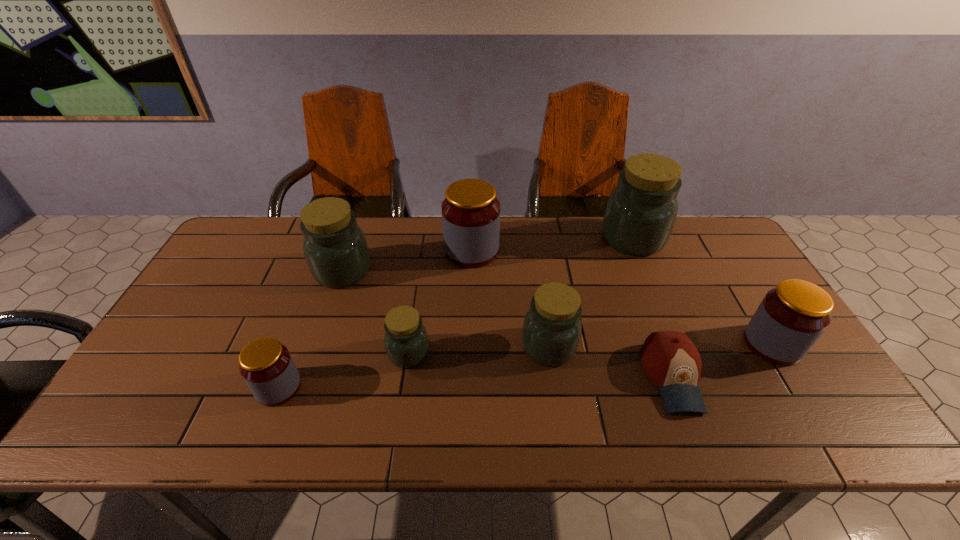
This screenshot has width=960, height=540. Find the location of `free space between the shortest object and the third biggest green jar`. free space between the shortest object and the third biggest green jar is located at coordinates (611, 362).

Where is `blank region between the leftmost green jar and the third jar from right to left`? This screenshot has width=960, height=540. blank region between the leftmost green jar and the third jar from right to left is located at coordinates (445, 309).

At what (x,y) coordinates should I click in order to perform the action: click on empty space that is in between the smallest green jar and the biggest red jar. Please return your answer as a coordinate pair (x, y). Looking at the image, I should click on point(441,302).

At what (x,y) coordinates should I click in order to perform the action: click on vacant area that lies between the fifth object from right to left and the leftmost green jar. Please return your answer as a coordinate pair (x, y). The image size is (960, 540). Looking at the image, I should click on (407, 261).

Find the location of `free spot between the sixth object from right to left and the fourth object from right to left`. free spot between the sixth object from right to left and the fourth object from right to left is located at coordinates (479, 350).

The image size is (960, 540). Find the location of `vacant area that lies between the fourth object from right to left and the tallest object`. vacant area that lies between the fourth object from right to left and the tallest object is located at coordinates (590, 293).

Image resolution: width=960 pixels, height=540 pixels. Identify the location of unoccupied area between the sixth object from right to left and the smallest red jar. (344, 370).

Find the location of a particular element. free space between the leftmost green jar and the smallest green jar is located at coordinates (375, 312).

Identify the location of object that ranks as the second closest to the leftmost green jar. (470, 212).

Choose which object is the sixth nearest neighbor to the third smallest green jar. Please provide its 2D coordinates. Your answer should be formatted as a tuple, i.e. [(x, y)], where the tuple contains the x and y coordinates of a point satisfying the conditions above.

[(670, 359)]